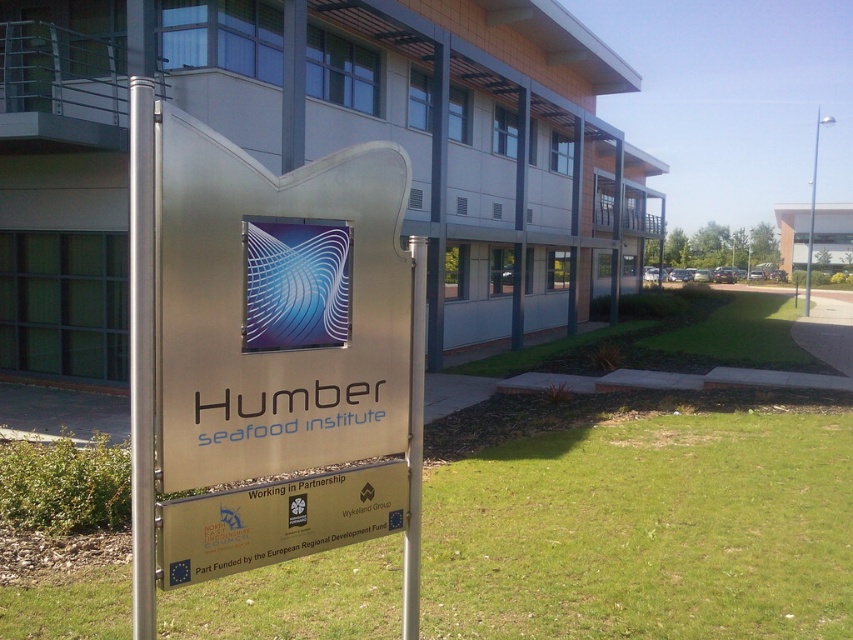
Question: Which of the following is the farthest from the observer?

Choices:
 (A) gold metallic sign at center
 (B) green grass at lower center
 (C) silver metallic pole at upper right

Answer: (C)

Question: Among these objects, which one is nearest to the camera?

Choices:
 (A) silver metallic pole at upper right
 (B) green grass at lower center
 (C) gold metallic sign at center
 (D) brushed metal sign at center

Answer: (D)

Question: Which object appears farthest from the camera in this image?

Choices:
 (A) green grass at lower center
 (B) silver metallic pole at upper right
 (C) brushed metal sign at center

Answer: (B)

Question: Is brushed metal sign at center wider than silver metallic pole at upper right?

Choices:
 (A) no
 (B) yes

Answer: (A)

Question: Is green grass at lower center positioned behind gold metallic sign at center?

Choices:
 (A) yes
 (B) no

Answer: (A)

Question: Where is brushed metal sign at center located in relation to green grass at lower center in the image?

Choices:
 (A) below
 (B) above

Answer: (B)